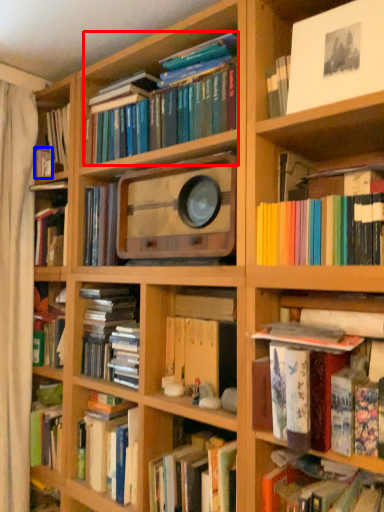
Question: Which object is further to the camera taking this photo, book (highlighted by a red box) or book (highlighted by a blue box)?

Choices:
 (A) book
 (B) book

Answer: (B)